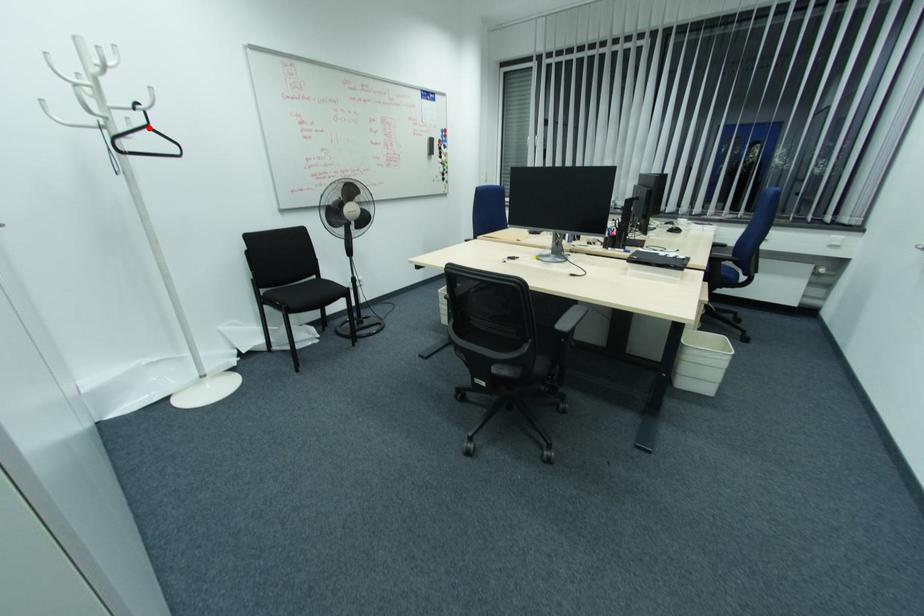
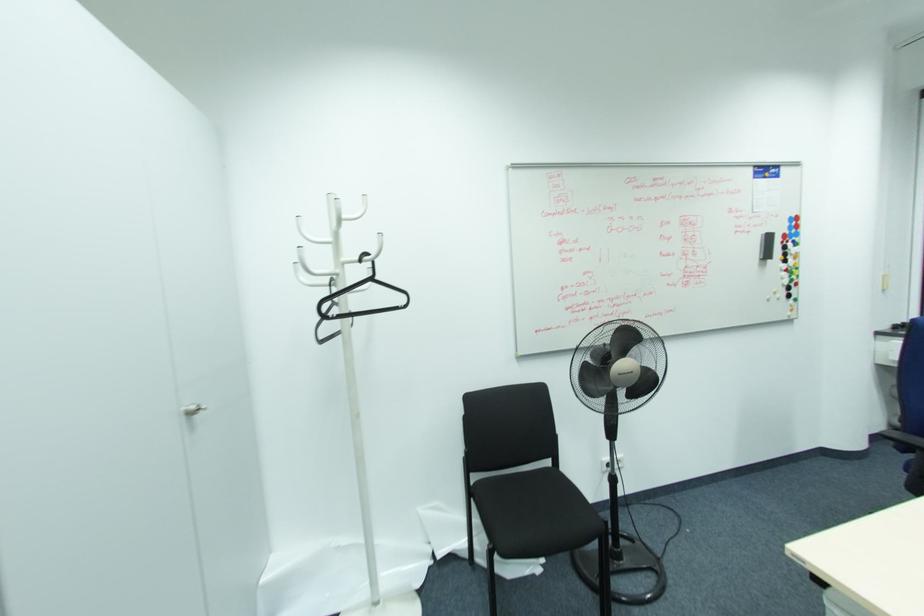
Question: I am providing you with two images of the same scene from different viewpoints. A red point is marked on the first image. At the location where the point appears in image 1, is it still visible in image 2?

Choices:
 (A) Yes
 (B) No

Answer: (A)